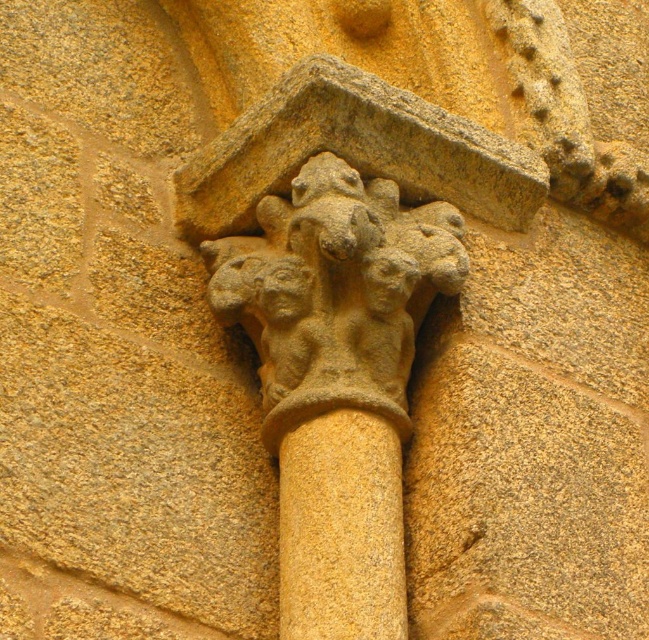
You are an architect examining the decorative architectural element. You notice the stone carved figures at upper center and the yellow stone column at center. Which one has a greater height?

The stone carved figures at upper center is much taller than the yellow stone column at center according to the description.

You are an architect examining the stone carvings in the image. You notice the stone carved figures at upper center and the yellow stone column at center. Based on their positions, which one is wider?

The stone carved figures at upper center might be wider than the yellow stone column at center according to the description.